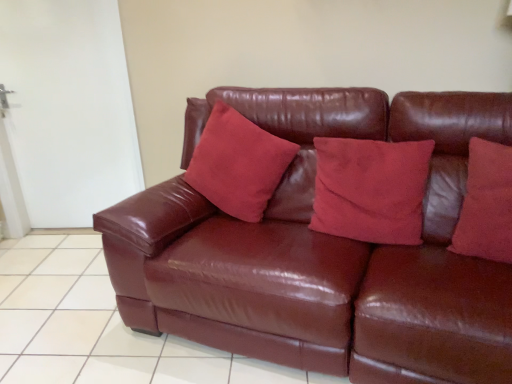
Question: Is shiny brown leather couch at center taller or shorter than suede-like red pillow at center, the 3th pillow when ordered from right to left?

Choices:
 (A) short
 (B) tall

Answer: (B)

Question: From the image's perspective, is shiny brown leather couch at center positioned above or below suede-like red pillow at center, the 3th pillow when ordered from right to left?

Choices:
 (A) below
 (B) above

Answer: (A)

Question: Which of these objects is positioned closest to the suede-like red pillow at right, which is counted as the 1th pillow, starting from the right?

Choices:
 (A) suede-like red pillow at center, the second pillow in the left-to-right sequence
 (B) suede-like red pillow at center, arranged as the 1th pillow when viewed from the left
 (C) glossy leather couch at center
 (D) shiny brown leather couch at center

Answer: (A)

Question: Which object is the farthest from the shiny brown leather couch at center?

Choices:
 (A) suede-like red pillow at center, the 3th pillow when ordered from right to left
 (B) glossy leather couch at center
 (C) suede-like red pillow at center, the second pillow in the left-to-right sequence
 (D) suede-like red pillow at right, which is counted as the 1th pillow, starting from the right

Answer: (B)